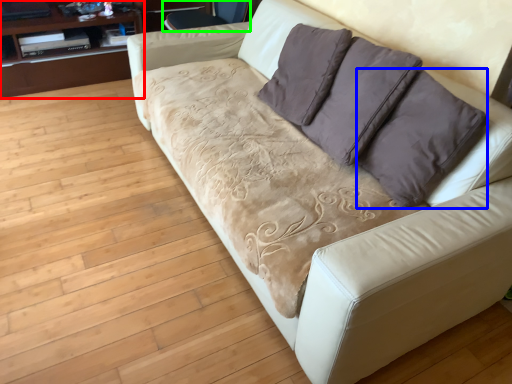
Question: Considering the real-world distances, which object is farthest from dresser (highlighted by a red box)? throw pillow (highlighted by a blue box) or armchair (highlighted by a green box)?

Choices:
 (A) throw pillow
 (B) armchair

Answer: (A)